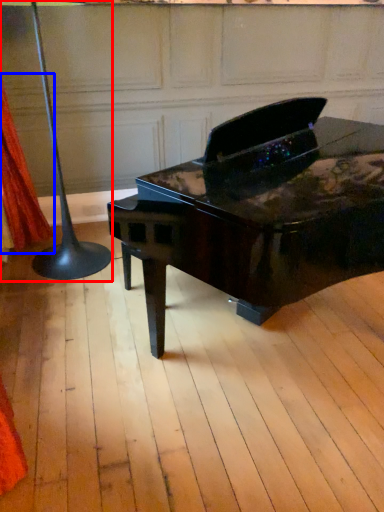
Question: Which of the following is the farthest to the observer, table lamp (highlighted by a red box) or curtain (highlighted by a blue box)?

Choices:
 (A) table lamp
 (B) curtain

Answer: (B)